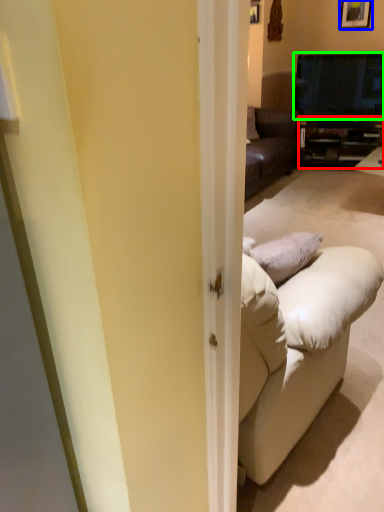
Question: Which object is the closest to the cabinetry (highlighted by a red box)? Choose among these: picture frame (highlighted by a blue box) or television (highlighted by a green box).

Choices:
 (A) picture frame
 (B) television

Answer: (B)